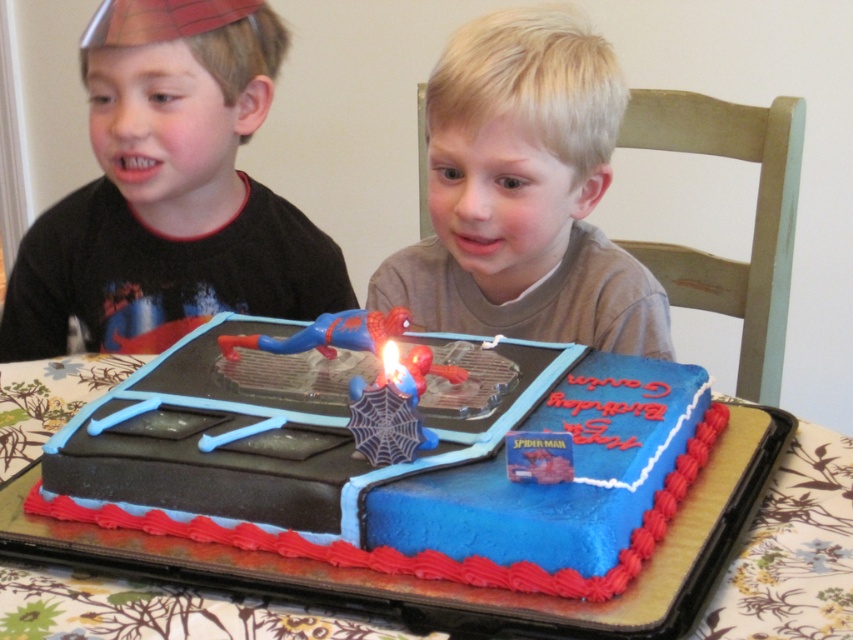
What is located at the point with coordinates (524, 195) in the birthday scene?

The point at coordinates (524, 195) corresponds to the blonde hair at upper center.

You are a photographer taking a picture of the birthday scene. You notice the matte black shirt at left and the blonde hair at upper center. Which one is closer to the camera?

The matte black shirt at left is closer to the camera because the blonde hair at upper center is behind it.

You are a photographer at the birthday party. You want to take a photo of the matte black shirt at left and the blue frosted cake at center. Which object should you focus on first if you need to adjust the focus from the closest to the farthest object?

The matte black shirt at left should be focused on first because it has a greater height compared to the blue frosted cake at center, meaning it is closer to the photographer.